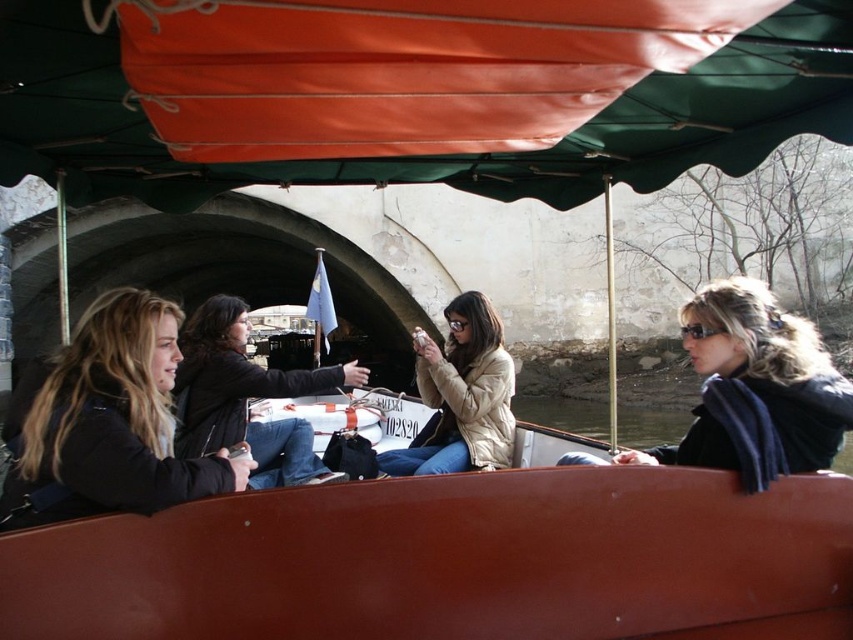
Is point (288, 461) positioned before point (463, 428)?

That is True.

Is dark brown leather jacket at center thinner than white fluffy coat at center?

No, dark brown leather jacket at center is not thinner than white fluffy coat at center.

Does point (283, 385) come closer to viewer compared to point (451, 412)?

Yes, it is in front of point (451, 412).

Locate an element on the screen. dark brown leather jacket at center is located at coordinates (245, 396).

Can you confirm if dark brown leather jacket at left is wider than black matte jacket at right?

Yes, dark brown leather jacket at left is wider than black matte jacket at right.

Which of these two, dark brown leather jacket at left or black matte jacket at right, stands shorter?

dark brown leather jacket at left

What do you see at coordinates (107, 420) in the screenshot? The height and width of the screenshot is (640, 853). I see `dark brown leather jacket at left` at bounding box center [107, 420].

The image size is (853, 640). Find the location of `dark brown leather jacket at left`. dark brown leather jacket at left is located at coordinates (107, 420).

Is smooth brown boat at center taller than black matte jacket at right?

In fact, smooth brown boat at center may be shorter than black matte jacket at right.

Does smooth brown boat at center appear over black matte jacket at right?

Incorrect, smooth brown boat at center is not positioned above black matte jacket at right.

You are a GUI agent. You are given a task and a screenshot of the screen. Output one action in this format:
    pyautogui.click(x=<x>, y=<y>)
    Task: Click on the smooth brown boat at center
    This screenshot has width=853, height=640.
    Given the screenshot: What is the action you would take?
    pyautogui.click(x=451, y=561)

Identify the location of smooth brown boat at center. The image size is (853, 640). (451, 561).